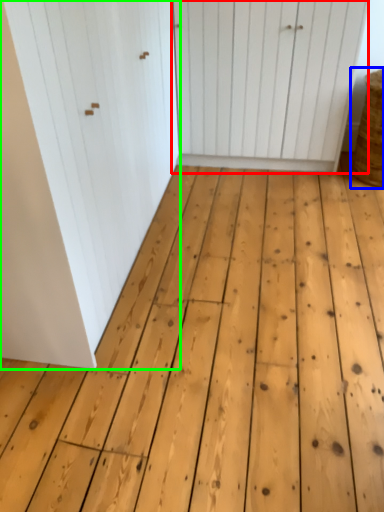
Question: Estimate the real-world distances between objects in this image. Which object is farther from door (highlighted by a red box), basket (highlighted by a blue box) or door (highlighted by a green box)?

Choices:
 (A) basket
 (B) door

Answer: (B)